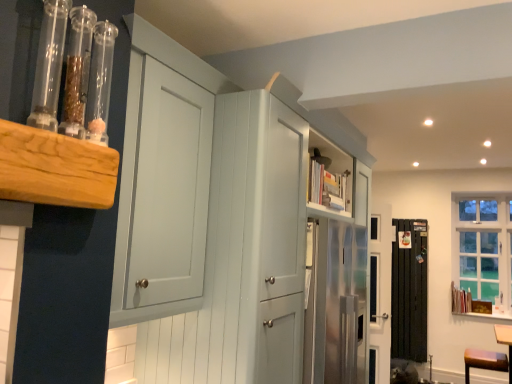
Where is `vacant space situated above brown wood vanity at lower right (from a real-world perspective)`? vacant space situated above brown wood vanity at lower right (from a real-world perspective) is located at coordinates (488, 357).